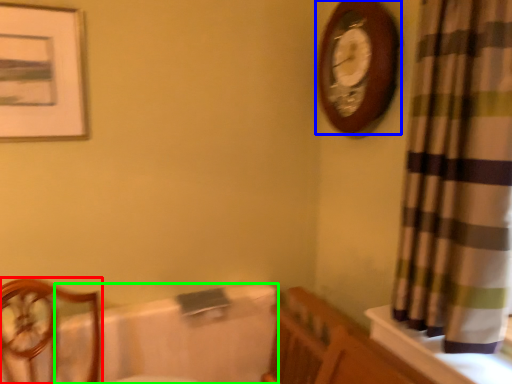
Question: Based on their relative distances, which object is nearer to furniture (highlighted by a red box)? Choose from wall clock (highlighted by a blue box) and bath (highlighted by a green box).

Choices:
 (A) wall clock
 (B) bath

Answer: (B)